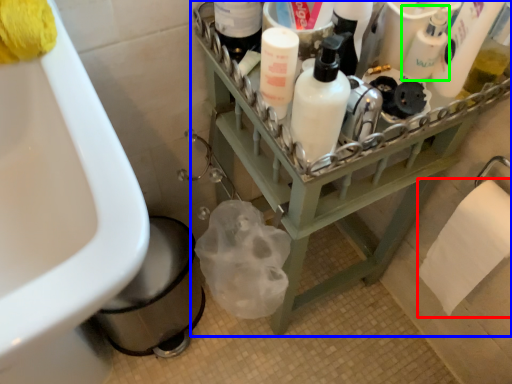
Question: Which object is positioned closest to toilet paper (highlighted by a red box)? Select from furniture (highlighted by a blue box) and cleaning product (highlighted by a green box).

Choices:
 (A) furniture
 (B) cleaning product

Answer: (A)